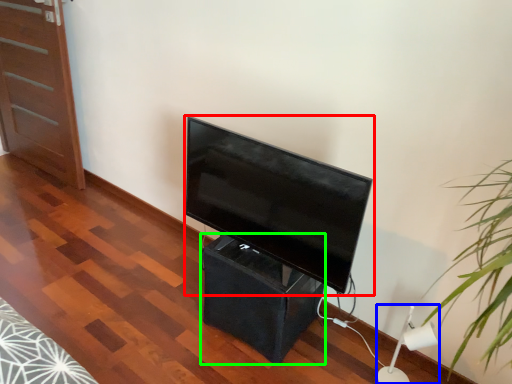
Question: Which is farther away from television (highlighted by a red box)? lamp (highlighted by a blue box) or table (highlighted by a green box)?

Choices:
 (A) lamp
 (B) table

Answer: (A)